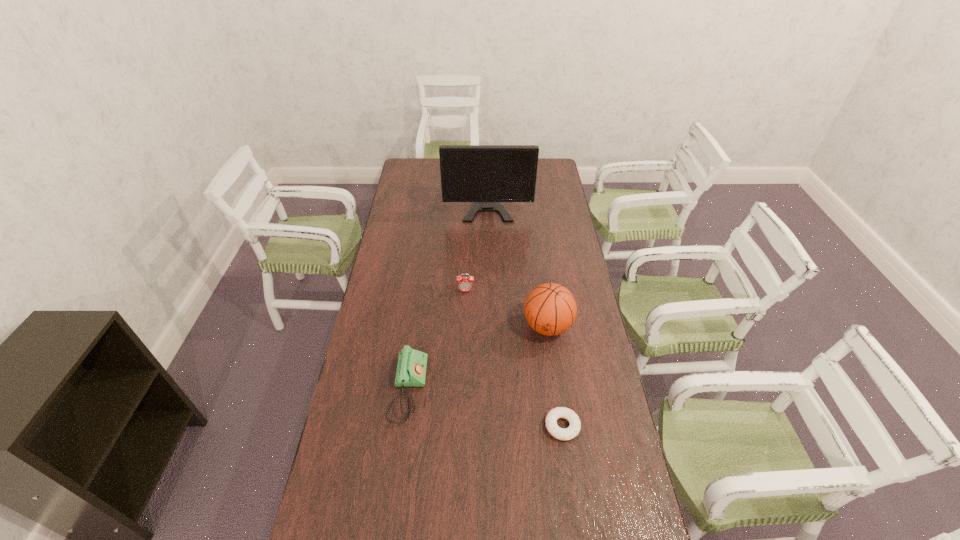
This screenshot has height=540, width=960. I want to click on vacant region located on the back of the third farthest object, so click(x=541, y=283).

The image size is (960, 540). Identify the location of free location located on the face of the third tallest object. (464, 336).

Find the location of a particular element. This screenshot has width=960, height=540. blank space located 0.070m on the dial of the telephone is located at coordinates (446, 389).

This screenshot has height=540, width=960. In order to click on blank area located 0.100m on the left of the doughnut in this screenshot , I will do `click(513, 426)`.

Find the location of a particular element. object at the far edge is located at coordinates click(485, 174).

The height and width of the screenshot is (540, 960). In order to click on object positioned at the left edge in this screenshot , I will do `click(411, 369)`.

Identify the location of basketball that is at the right edge. This screenshot has width=960, height=540. (550, 309).

The height and width of the screenshot is (540, 960). I want to click on doughnut that is at the right edge, so click(572, 431).

Locate an element on the screen. free space at the left edge of the desktop is located at coordinates (367, 476).

Locate an element on the screen. blank space at the right edge of the desktop is located at coordinates (575, 474).